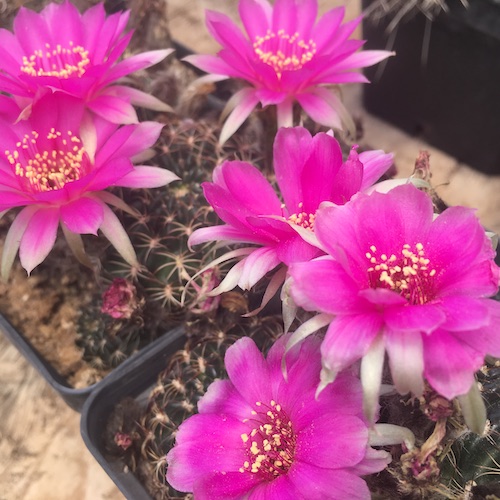
Find the location of a particular element. This screenshot has height=500, width=500. tray is located at coordinates (118, 386).